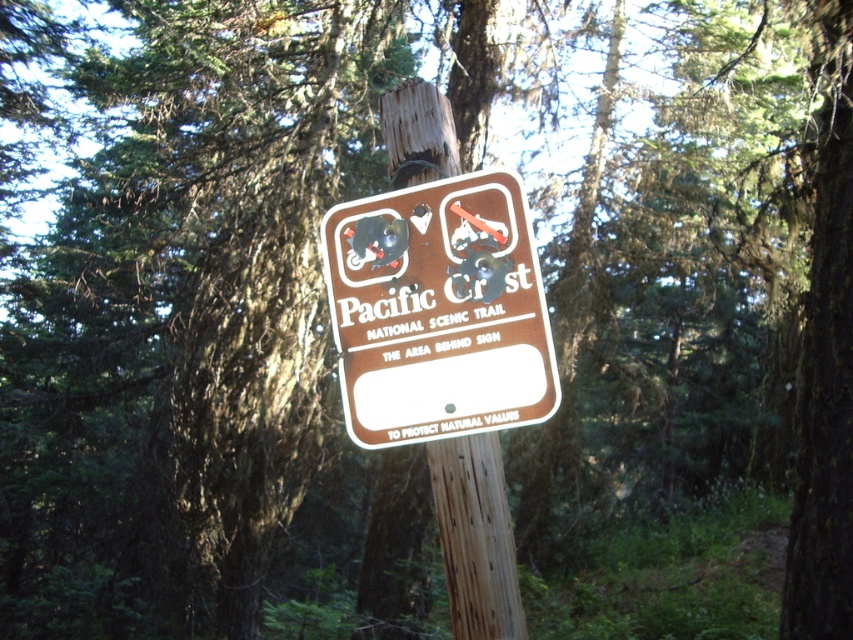
Question: Is brown matte sign at center wider than brown wood pole at center?

Choices:
 (A) yes
 (B) no

Answer: (A)

Question: Which of the following is the farthest from the observer?

Choices:
 (A) (451, 422)
 (B) (381, 544)

Answer: (B)

Question: Does brown matte sign at center appear on the right side of brown wood pole at center?

Choices:
 (A) yes
 (B) no

Answer: (A)

Question: Which of the following is the farthest from the observer?

Choices:
 (A) brown matte sign at center
 (B) brown wood pole at center

Answer: (B)

Question: Is brown matte sign at center to the left of brown wood pole at center from the viewer's perspective?

Choices:
 (A) no
 (B) yes

Answer: (A)